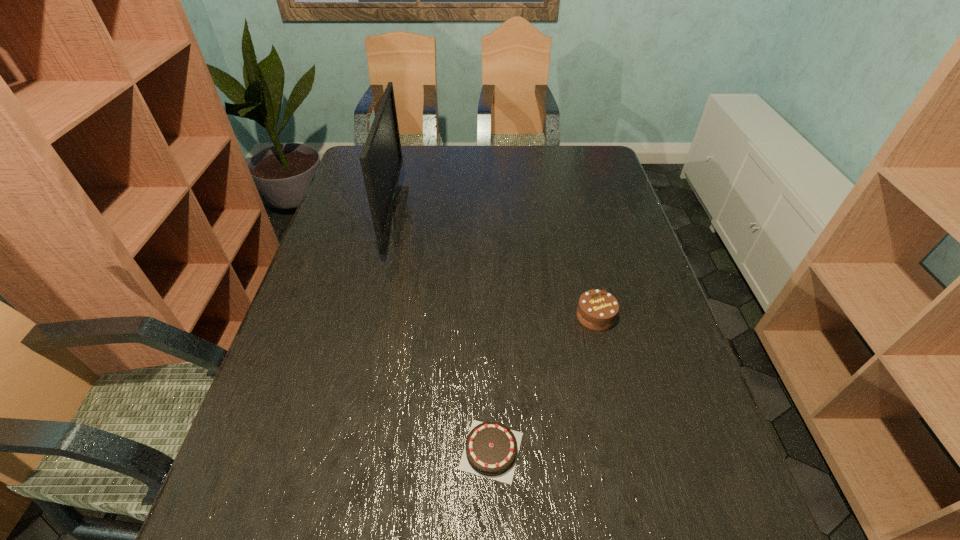
The width and height of the screenshot is (960, 540). I want to click on the farthest object, so point(381,159).

Find the location of a particular element. monitor is located at coordinates (381, 159).

This screenshot has height=540, width=960. In order to click on the second tallest object in this screenshot , I will do `click(597, 310)`.

Where is `the right chocolate cake`? the right chocolate cake is located at coordinates (597, 310).

Identify the location of the shorter chocolate cake. (491, 450).

The height and width of the screenshot is (540, 960). I want to click on the shortest object, so click(491, 450).

Find the location of a particular element. vacant space located on the front-facing side of the tallest object is located at coordinates (487, 217).

Where is `vacant area located 0.400m on the left of the second tallest object`? This screenshot has width=960, height=540. vacant area located 0.400m on the left of the second tallest object is located at coordinates (415, 316).

Identify the location of free location located on the right of the shorter chocolate cake. [565, 450].

What are the coordinates of `object that is at the far edge` in the screenshot? It's located at (381, 159).